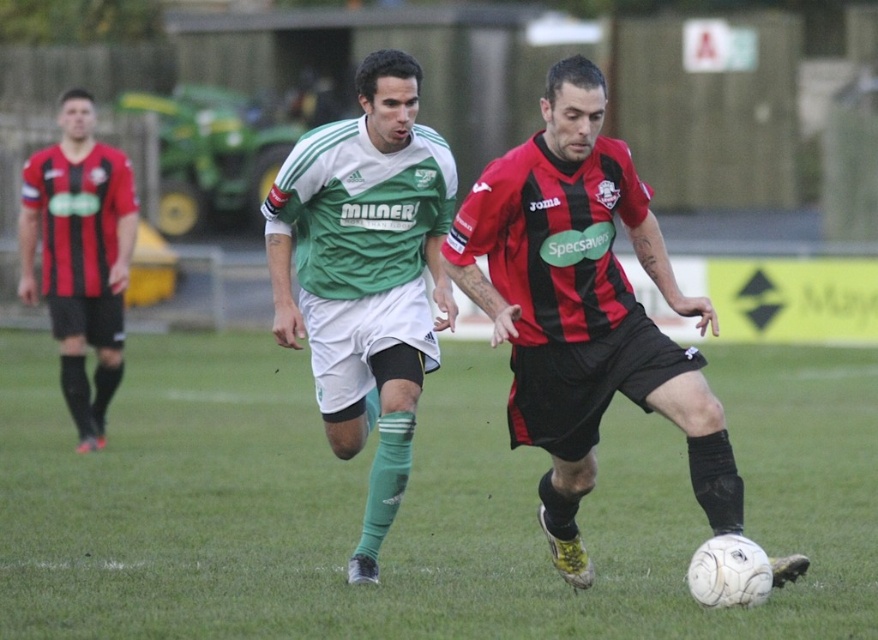
You are a soccer referee observing the game. You notice two points marked on the field at coordinates point (462, 260) and point (301, 328). Which point is nearer to your vantage point as the referee?

Point (462, 260) is closer to the camera than point (301, 328), so the referee would perceive it as nearer.